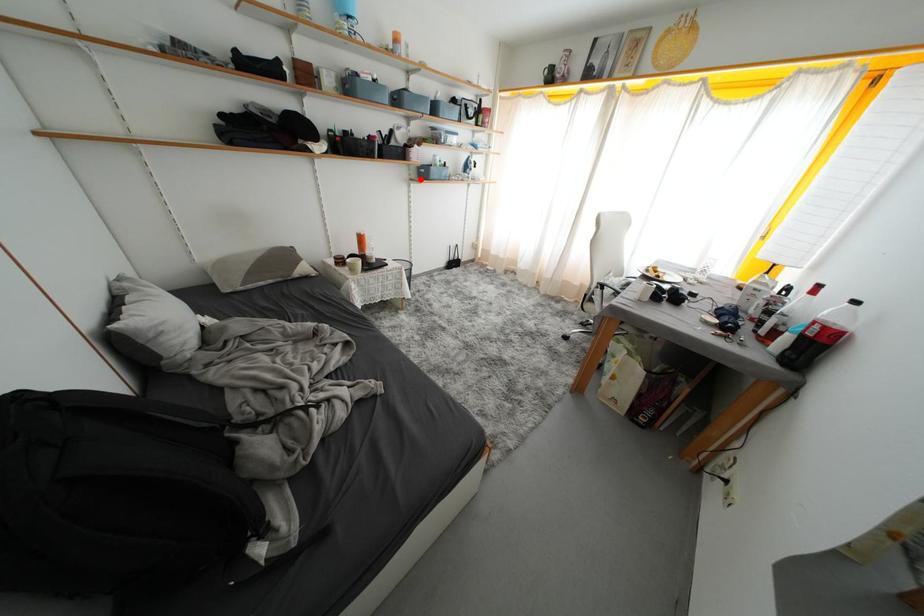
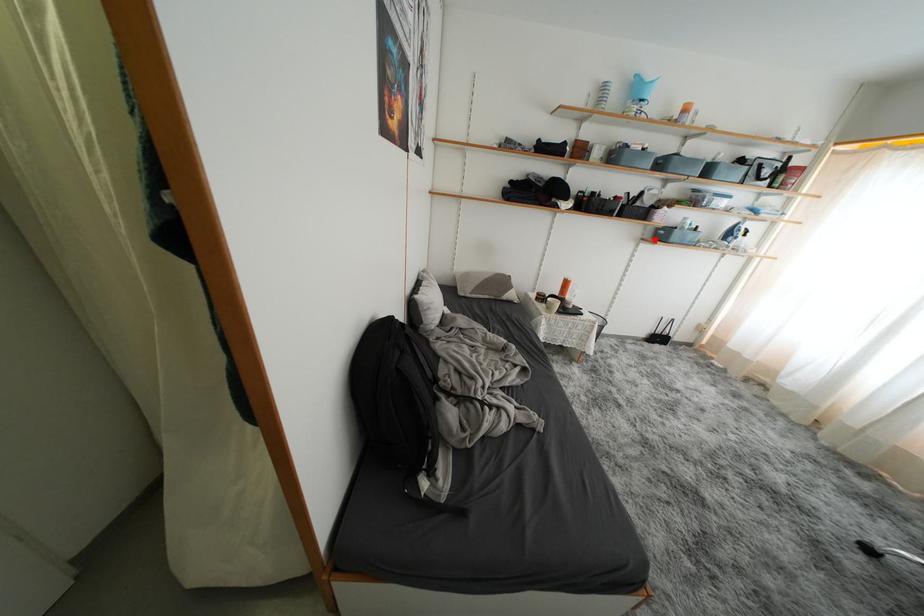
I am providing you with two images of the same scene from different viewpoints. A red point is marked on the first image and another point is marked on the second image. Do the highlighted points in image1 and image2 indicate the same real-world spot?

Yes